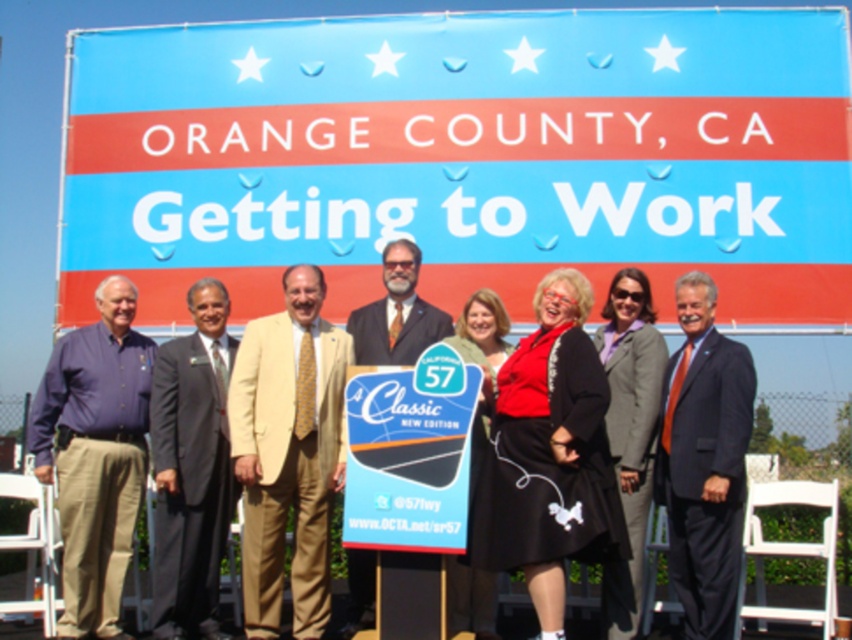
Is matte blue shirt at left positioned before dark gray suit at center?

Yes, it is.

Is matte blue shirt at left above dark gray suit at center?

Indeed, matte blue shirt at left is positioned over dark gray suit at center.

Does point (96, 561) lie in front of point (171, 451)?

That is True.

This screenshot has width=852, height=640. Identify the location of matte blue shirt at left. (95, 454).

Who is positioned more to the right, light beige suit at center or beige textured suit at center?

beige textured suit at center

Is point (235, 397) closer to camera compared to point (415, 305)?

Yes, point (235, 397) is in front of point (415, 305).

The width and height of the screenshot is (852, 640). Identify the location of light beige suit at center. 288,452.

What are the coordinates of `light beige suit at center` in the screenshot? It's located at (288, 452).

Which is in front, point (213, 364) or point (440, 518)?

Point (440, 518) is in front.

Is dark gray suit at center above blue plastic sign at center?

No.

Is point (182, 520) closer to viewer compared to point (439, 410)?

No, it is not.

Where is `dark gray suit at center`? The height and width of the screenshot is (640, 852). dark gray suit at center is located at coordinates (191, 468).